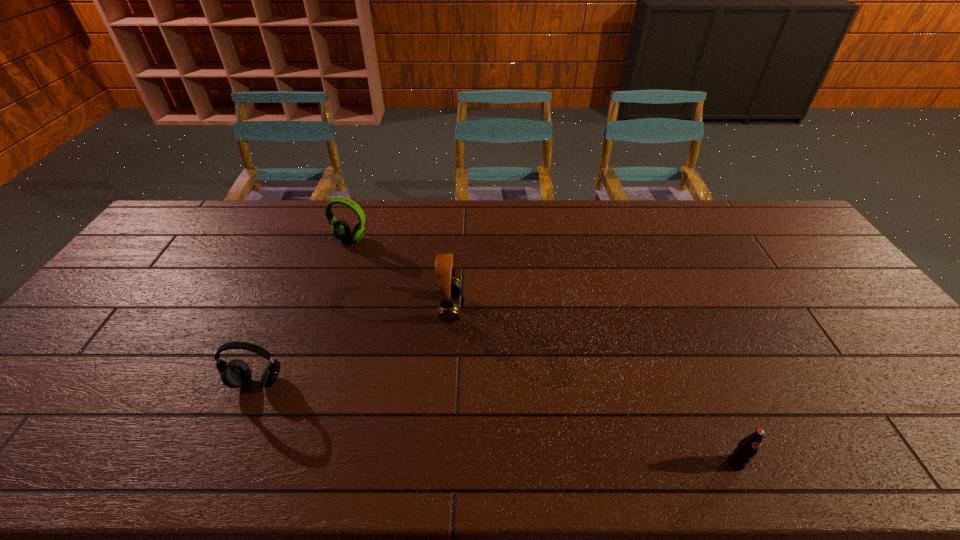
Find the location of a particular element. This screenshot has height=540, width=960. headset that is the second closest to the rightmost object is located at coordinates (236, 373).

Where is `vacant space that satisfies the following two spatial constraints: 1. on the ear cups of the second farthest headset; 2. on the ear cups of the nearest headset`? vacant space that satisfies the following two spatial constraints: 1. on the ear cups of the second farthest headset; 2. on the ear cups of the nearest headset is located at coordinates (445, 382).